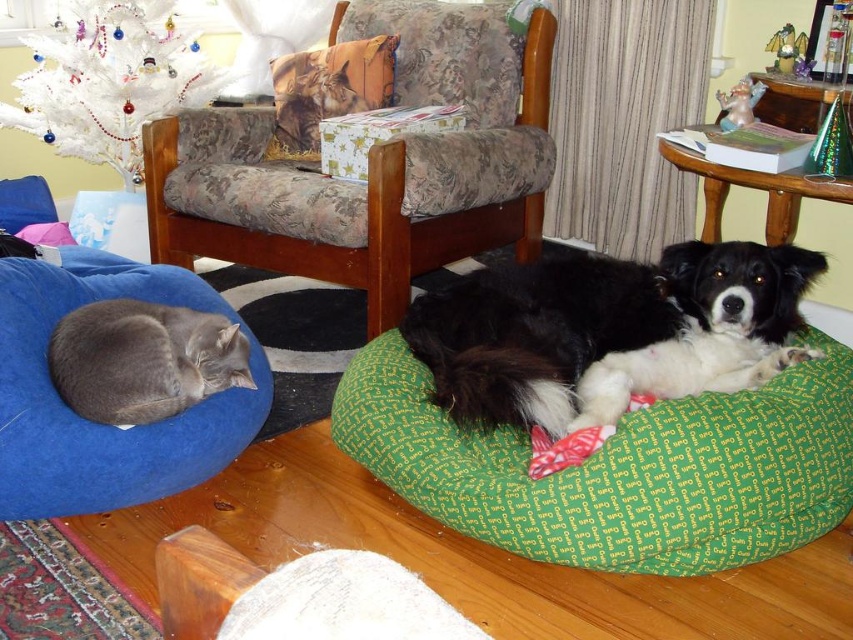
What are the coordinates of the green fabric dog bed at lower right?

The green fabric dog bed at lower right is located at coordinates point (x=619, y=468).